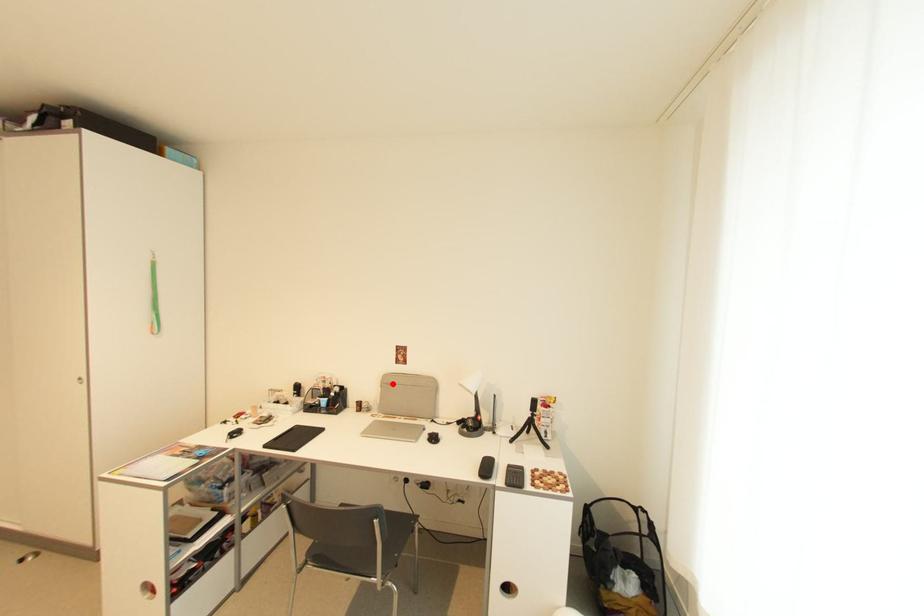
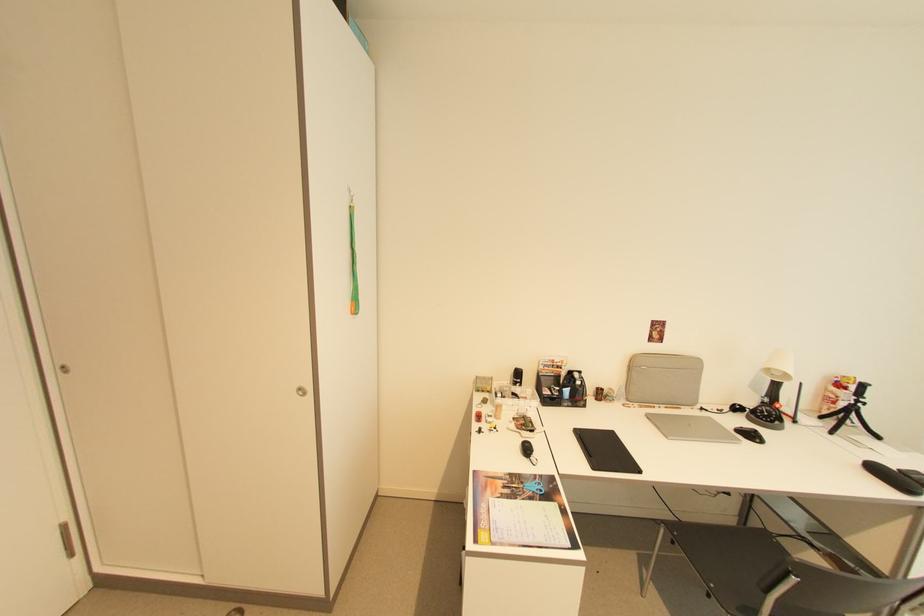
In the second image, find the point that corresponds to the highlighted location in the first image.

(638, 366)